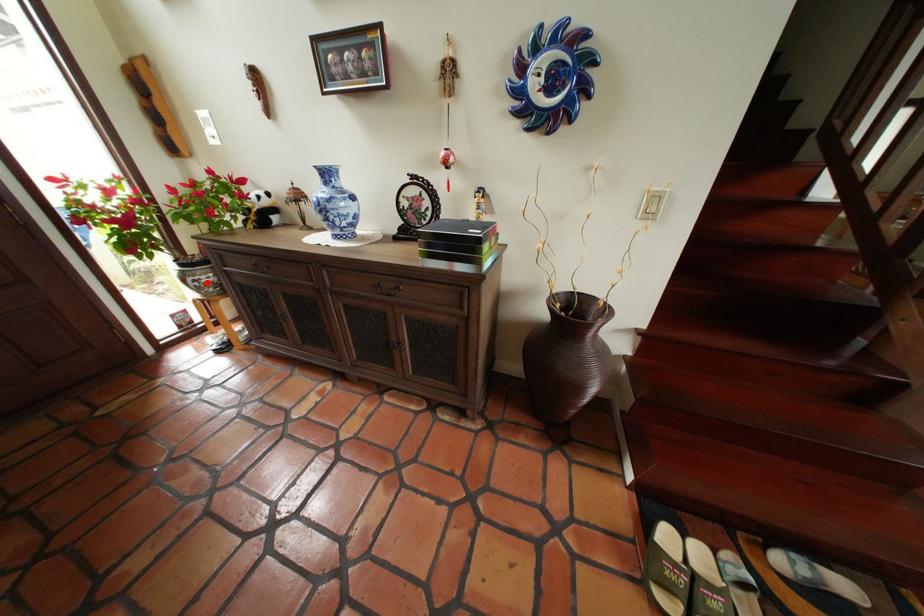
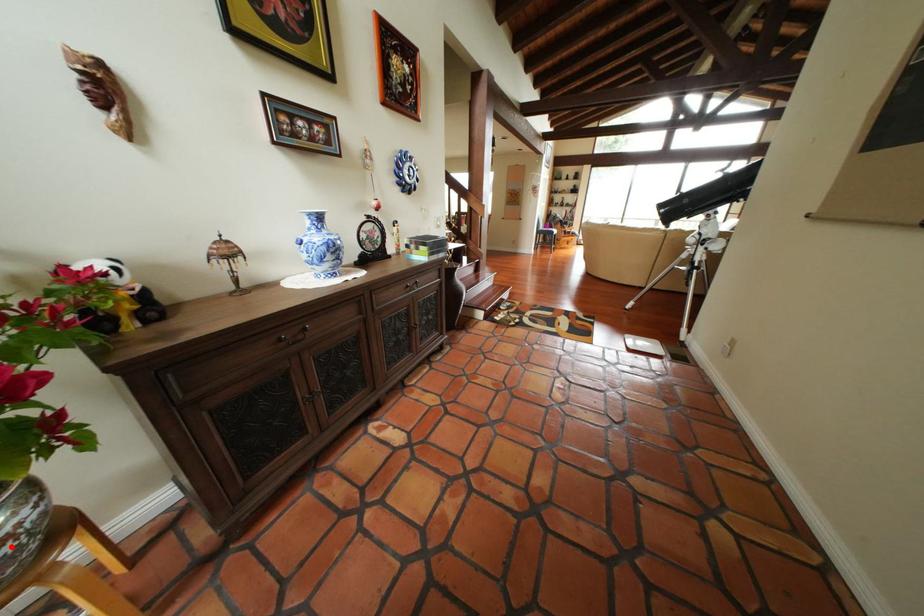
I am providing you with two images of the same scene from different viewpoints. A red point is marked on the first image and another point is marked on the second image. Do the highlighted points in image1 and image2 indicate the same real-world spot?

Yes